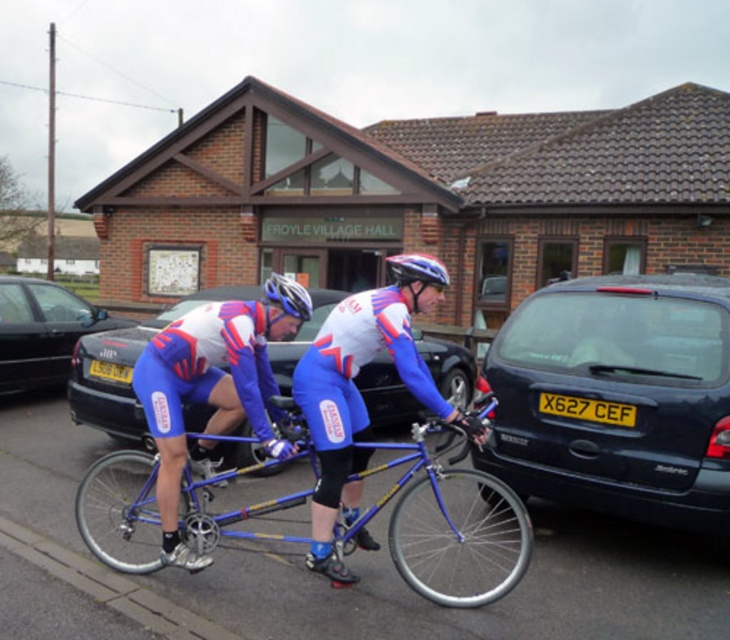
Question: Does blue/white jersey at center come behind metallic blue bicycle at center?

Choices:
 (A) yes
 (B) no

Answer: (B)

Question: In this image, where is blue metallic tandem bicycle at center located relative to black metallic car at left?

Choices:
 (A) above
 (B) below

Answer: (B)

Question: Based on their relative distances, which object is farther from the black metallic car at left?

Choices:
 (A) metallic blue bicycle at center
 (B) blue metallic tandem bicycle at center
 (C) yellowmaterial/texturelicense plate at center

Answer: (C)

Question: Which object is positioned closest to the dark blue metallic car at right?

Choices:
 (A) blue fabric cycling suit at center
 (B) matte blue helmet at center
 (C) white matte bicycle helmet at center

Answer: (A)

Question: Based on their relative distances, which object is nearer to the black metallic car at left?

Choices:
 (A) blue/white jersey at center
 (B) dark blue metallic car at right
 (C) yellow matte license plate at center

Answer: (C)

Question: Is blue fabric cycling suit at center further to the viewer compared to yellow matte license plate at center?

Choices:
 (A) no
 (B) yes

Answer: (A)